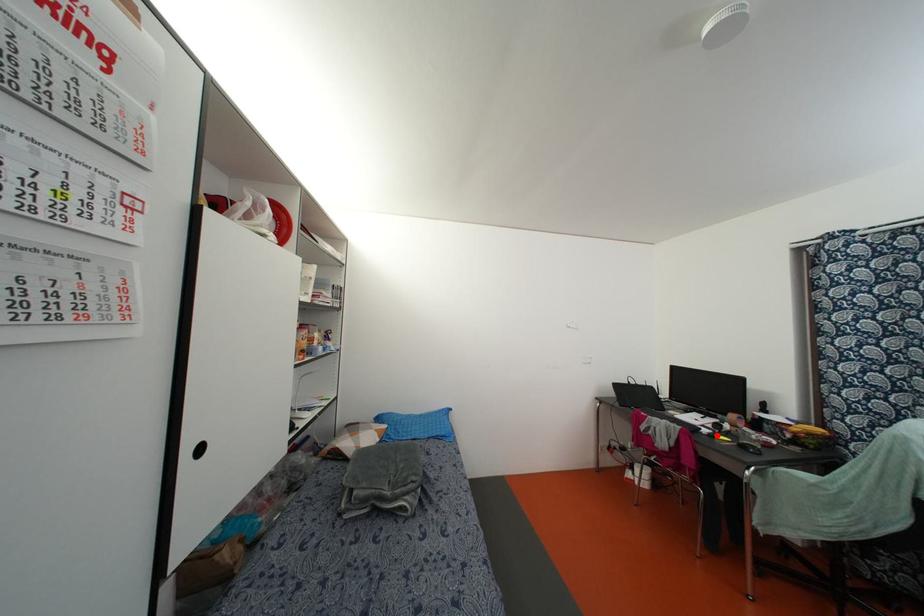
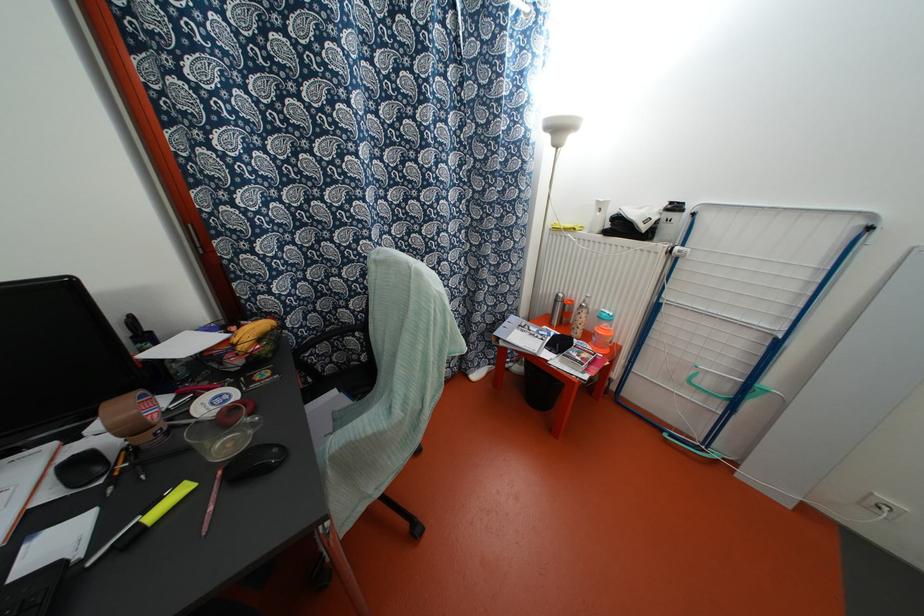
Where in the second image is the point corresponding to the highlighted location from the first image?

(152, 515)